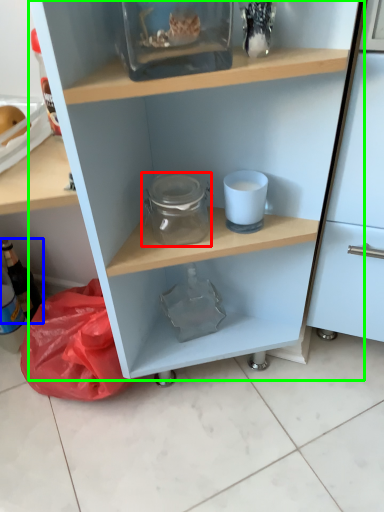
Question: Considering the real-world distances, which object is farthest from glass jar (highlighted by a red box)? bottle (highlighted by a blue box) or shelf (highlighted by a green box)?

Choices:
 (A) bottle
 (B) shelf

Answer: (A)